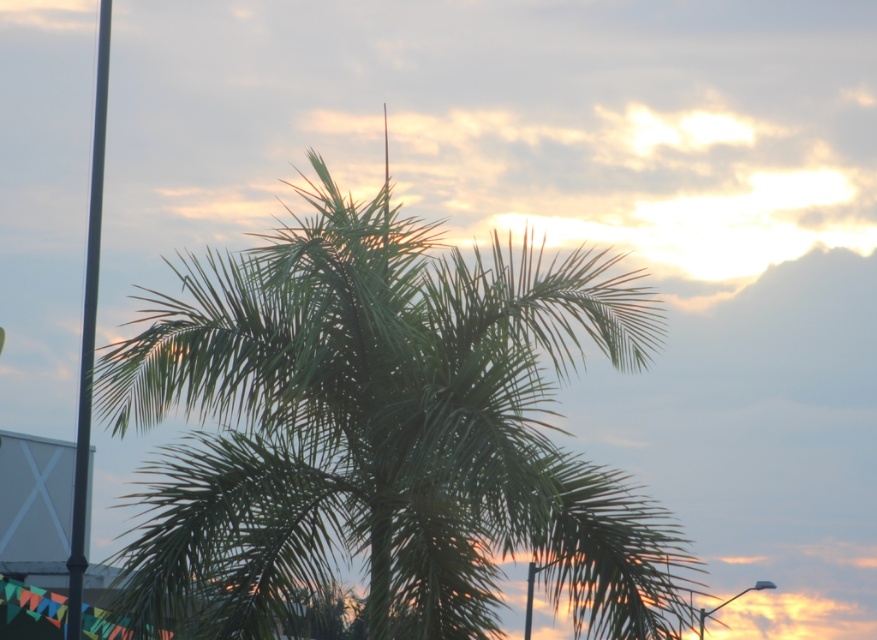
Question: Which point is farther from the camera taking this photo?

Choices:
 (A) (82, 369)
 (B) (113, 376)

Answer: (A)

Question: Observing the image, what is the correct spatial positioning of green leafy palm tree at center in reference to metallic pole at left?

Choices:
 (A) left
 (B) right

Answer: (B)

Question: Does green leafy palm tree at center have a greater width compared to metallic pole at left?

Choices:
 (A) yes
 (B) no

Answer: (B)

Question: Among these objects, which one is farthest from the camera?

Choices:
 (A) metallic pole at left
 (B) green leafy palm tree at center

Answer: (B)

Question: Does green leafy palm tree at center have a smaller size compared to metallic pole at left?

Choices:
 (A) yes
 (B) no

Answer: (A)